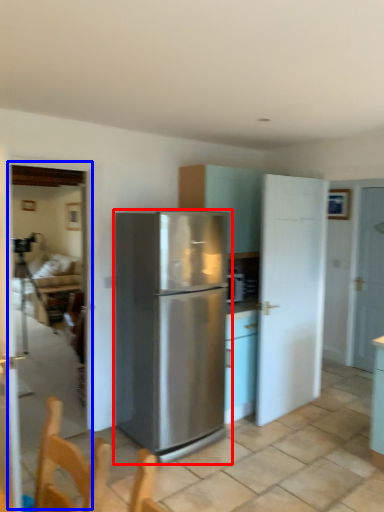
Question: Which point is closer to the camera, refrigerator (highlighted by a red box) or glass door (highlighted by a blue box)?

Choices:
 (A) refrigerator
 (B) glass door

Answer: (A)